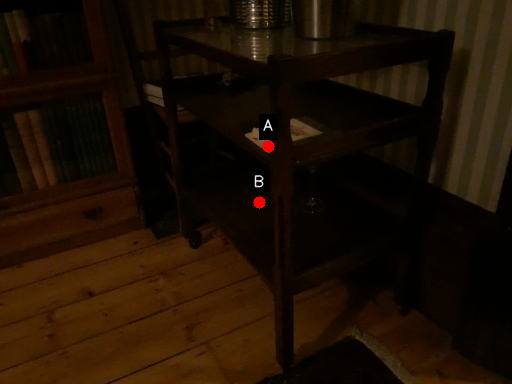
Question: Two points are circled on the image, labeled by A and B beside each circle. Among these points, which one is nearest to the camera?

Choices:
 (A) A is closer
 (B) B is closer

Answer: (A)